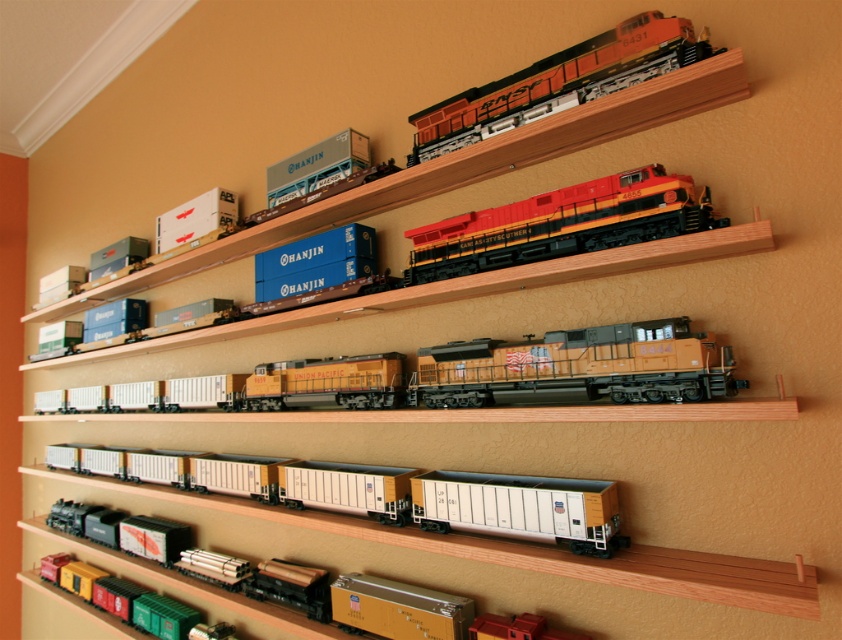
From the picture: You are an interior designer planning to place a new decorative item on the wooden shelves where the white matte freight cars at center and the orange matte train at upper center are displayed. Considering their widths, which object should you avoid placing a wider item next to to maintain balance?

The white matte freight cars at center are wider than the orange matte train at upper center, so placing a wider item next to the orange matte train at upper center would disrupt the balance. Avoid placing a wider item next to the orange matte train at upper center.